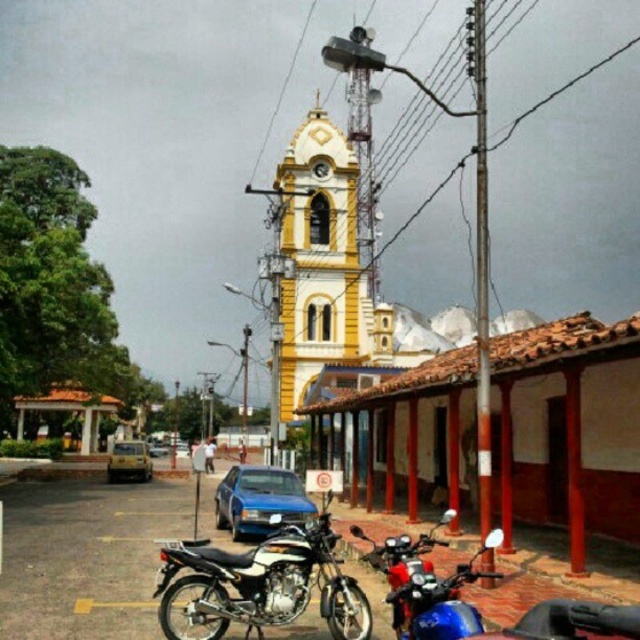
Between yellow painted stone clock tower at center and shiny black motorcycle at center, which one has more height?

Standing taller between the two is yellow painted stone clock tower at center.

Does yellow painted stone clock tower at center come in front of shiny black motorcycle at center?

No, yellow painted stone clock tower at center is further to the viewer.

This screenshot has width=640, height=640. Find the location of `yellow painted stone clock tower at center`. yellow painted stone clock tower at center is located at coordinates (317, 268).

Between blue matte car at lower center and yellow matte taxi at center, which one appears on the left side from the viewer's perspective?

Positioned to the left is yellow matte taxi at center.

Is blue matte car at lower center taller than yellow matte taxi at center?

Correct, blue matte car at lower center is much taller as yellow matte taxi at center.

Locate an element on the screen. Image resolution: width=640 pixels, height=640 pixels. blue matte car at lower center is located at coordinates (259, 500).

At what (x,y) coordinates should I click in order to perform the action: click on blue matte car at lower center. Please return your answer as a coordinate pair (x, y). Image resolution: width=640 pixels, height=640 pixels. Looking at the image, I should click on (259, 500).

Is point (301, 227) farther from camera compared to point (403, 550)?

Yes, it is.

Is yellow painted stone clock tower at center above shiny chrome motorcycle at center?

Indeed, yellow painted stone clock tower at center is positioned over shiny chrome motorcycle at center.

Does point (371, 216) lie in front of point (372, 550)?

No, (371, 216) is further to viewer.

The width and height of the screenshot is (640, 640). What are the coordinates of `yellow painted stone clock tower at center` in the screenshot? It's located at (317, 268).